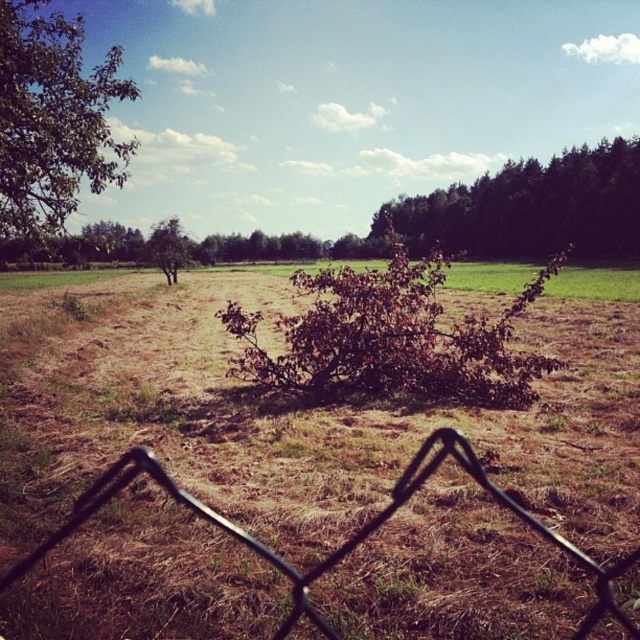
You are a photographer standing at the edge of the field. You want to take a photo that includes both the dark green leafy tree at upper right and the green grass at center. Based on their positions, which object should you adjust your camera to focus on first to ensure both are in the frame?

Since the dark green leafy tree at upper right is to the right of green grass at center, you should focus on the dark green leafy tree at upper right first to ensure both are included in the frame.